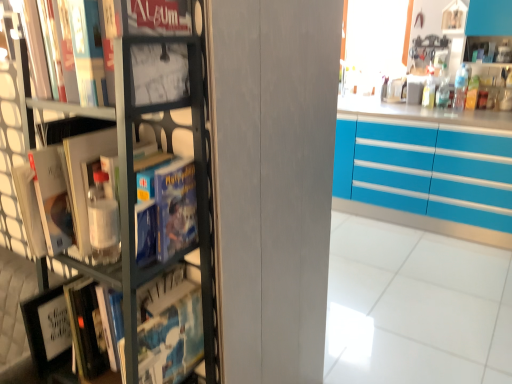
This screenshot has width=512, height=384. Describe the element at coordinates (126, 183) in the screenshot. I see `metallic gray bookcase at left` at that location.

Identify the location of turquoise glossy cabinets at right. The width and height of the screenshot is (512, 384). (426, 170).

Is turquoise glossy cabinets at right directly adjacent to matte black book at upper left?

No, turquoise glossy cabinets at right is not making contact with matte black book at upper left.

Is turquoise glossy cabinets at right facing away from matte black book at upper left?

turquoise glossy cabinets at right does not have its back to matte black book at upper left.

Is turquoise glossy cabinets at right further to the viewer compared to matte black book at upper left?

Yes, the depth of turquoise glossy cabinets at right is greater than that of matte black book at upper left.

From a real-world perspective, which is physically above, turquoise glossy cabinets at right or matte black book at upper left?

From a 3D spatial view, matte black book at upper left is above.

At what (x,y) coordinates should I click in order to perform the action: click on bookcase below the turquoise glossy cabinets at right (from the image's perspective). Please return your answer as a coordinate pair (x, y). Image resolution: width=512 pixels, height=384 pixels. Looking at the image, I should click on (126, 183).

From their relative heights in the image, would you say turquoise glossy cabinets at right is taller or shorter than metallic gray bookcase at left?

turquoise glossy cabinets at right is shorter than metallic gray bookcase at left.

Can you confirm if turquoise glossy cabinets at right is smaller than metallic gray bookcase at left?

Incorrect, turquoise glossy cabinets at right is not smaller in size than metallic gray bookcase at left.

Considering the relative sizes of turquoise glossy cabinets at right and metallic gray bookcase at left in the image provided, is turquoise glossy cabinets at right wider than metallic gray bookcase at left?

Yes.

Looking at their sizes, would you say metallic gray bookcase at left is wider or thinner than turquoise glossy cabinets at right?

Clearly, metallic gray bookcase at left has less width compared to turquoise glossy cabinets at right.

Between metallic gray bookcase at left and turquoise glossy cabinets at right, which one has less height?

turquoise glossy cabinets at right.

Is metallic gray bookcase at left positioned in front of turquoise glossy cabinets at right?

Yes, metallic gray bookcase at left is in front of turquoise glossy cabinets at right.

Based on their sizes in the image, would you say matte black book at upper left is bigger or smaller than metallic gray bookcase at left?

Considering their sizes, matte black book at upper left takes up less space than metallic gray bookcase at left.

Which is behind, point (163, 9) or point (137, 108)?

Positioned behind is point (163, 9).

Find the location of a particular element. bookcase lying on the left of matte black book at upper left is located at coordinates (126, 183).

Are matte black book at upper left and metallic gray bookcase at left far apart?

That's not correct — matte black book at upper left is a little close to metallic gray bookcase at left.

Is matte black book at upper left oriented away from turquoise glossy cabinets at right?

No, matte black book at upper left is not facing the opposite direction of turquoise glossy cabinets at right.

Find the location of a particular element. book in front of the turquoise glossy cabinets at right is located at coordinates (142, 20).

Can you confirm if matte black book at upper left is positioned to the right of turquoise glossy cabinets at right?

No.

Would you say matte black book at upper left contains turquoise glossy cabinets at right?

That's incorrect, turquoise glossy cabinets at right is not inside matte black book at upper left.

From the image's perspective, which one is positioned lower, metallic gray bookcase at left or matte black book at upper left?

metallic gray bookcase at left, from the image's perspective.

Which of these two, metallic gray bookcase at left or matte black book at upper left, is thinner?

matte black book at upper left.

From a real-world perspective, which object stands above the other?

matte black book at upper left, from a real-world perspective.

At what (x,y) coordinates should I click in order to perform the action: click on bookcase below the matte black book at upper left (from the image's perspective). Please return your answer as a coordinate pair (x, y). The height and width of the screenshot is (384, 512). Looking at the image, I should click on (126, 183).

The image size is (512, 384). I want to click on cabinetry lying on the right of matte black book at upper left, so click(x=426, y=170).

This screenshot has width=512, height=384. What are the coordinates of `bookcase above the turquoise glossy cabinets at right (from a real-world perspective)` in the screenshot? It's located at (126, 183).

Considering their positions, is matte black book at upper left positioned further to turquoise glossy cabinets at right than metallic gray bookcase at left?

Based on the image, matte black book at upper left appears to be further to turquoise glossy cabinets at right.

Looking at the image, which one is located closer to metallic gray bookcase at left, turquoise glossy cabinets at right or matte black book at upper left?

matte black book at upper left.

Considering their positions, is metallic gray bookcase at left positioned closer to turquoise glossy cabinets at right than matte black book at upper left?

metallic gray bookcase at left is closer to turquoise glossy cabinets at right.

From the image, which object appears to be nearer to metallic gray bookcase at left, matte black book at upper left or turquoise glossy cabinets at right?

matte black book at upper left is closer to metallic gray bookcase at left.

From the image, which object appears to be nearer to matte black book at upper left, metallic gray bookcase at left or turquoise glossy cabinets at right?

metallic gray bookcase at left is closer to matte black book at upper left.

Estimate the real-world distances between objects in this image. Which object is closer to matte black book at upper left, turquoise glossy cabinets at right or metallic gray bookcase at left?

Based on the image, metallic gray bookcase at left appears to be nearer to matte black book at upper left.

At what (x,y) coordinates should I click in order to perform the action: click on book between metallic gray bookcase at left and turquoise glossy cabinets at right from front to back. Please return your answer as a coordinate pair (x, y). Image resolution: width=512 pixels, height=384 pixels. Looking at the image, I should click on (142, 20).